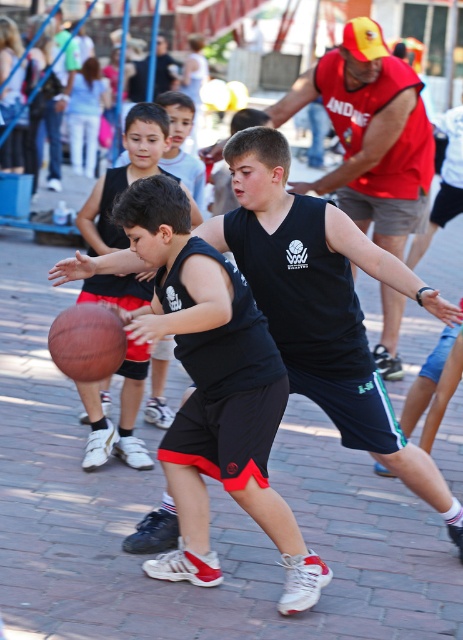
You are standing at the point marked as point (152, 125) and want to throw a ball to a friend who is 6 meters away from you. Can you reach your friend with a single throw?

The distance between you and the friend is 5.50 meters, so yes, you can reach them with a single throw since it is within the 6 meters range.